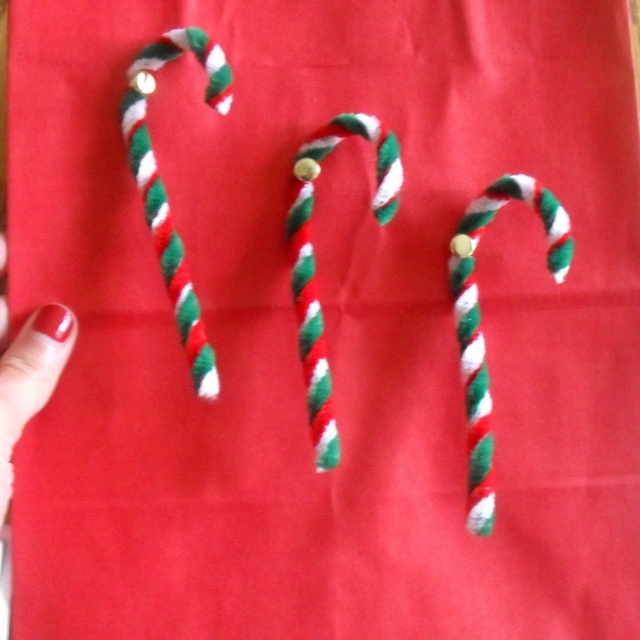
You are a gift wrapper preparing to place a twisted fabric candy cane at right and a twisted matte candy cane at center into a box. The box can only fit one of them. Which candy cane should you choose to ensure it fits?

The twisted matte candy cane at center is smaller than the twisted fabric candy cane at right, so you should choose the twisted matte candy cane at center to ensure it fits in the box.

You are organizing a Christmas display and have two candy canes to place on a shelf. You have a twisted woolen candy cane at left and a twisted matte candy cane at center. Which candy cane is smaller and should be placed in a spot that requires less space?

The twisted woolen candy cane at left is smaller than the twisted matte candy cane at center, so it should be placed in a spot that requires less space.

You are a child trying to grab the candy canes. Which one is closer to your right hand if you see the twisted fabric candy cane at right and the twisted woolen candy cane at left in front of you?

The twisted fabric candy cane at right is to the right of the twisted woolen candy cane at left, so it will be closer to your right hand.